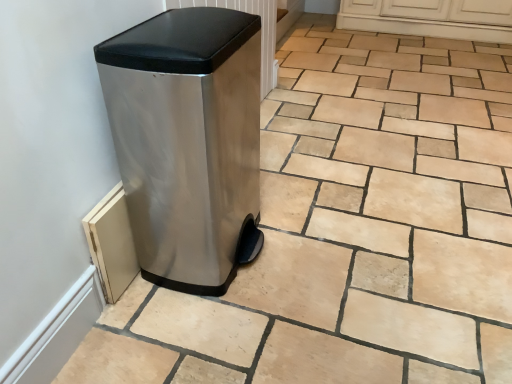
Identify the location of free space in front of stainless steel trash can at left. This screenshot has width=512, height=384. (209, 335).